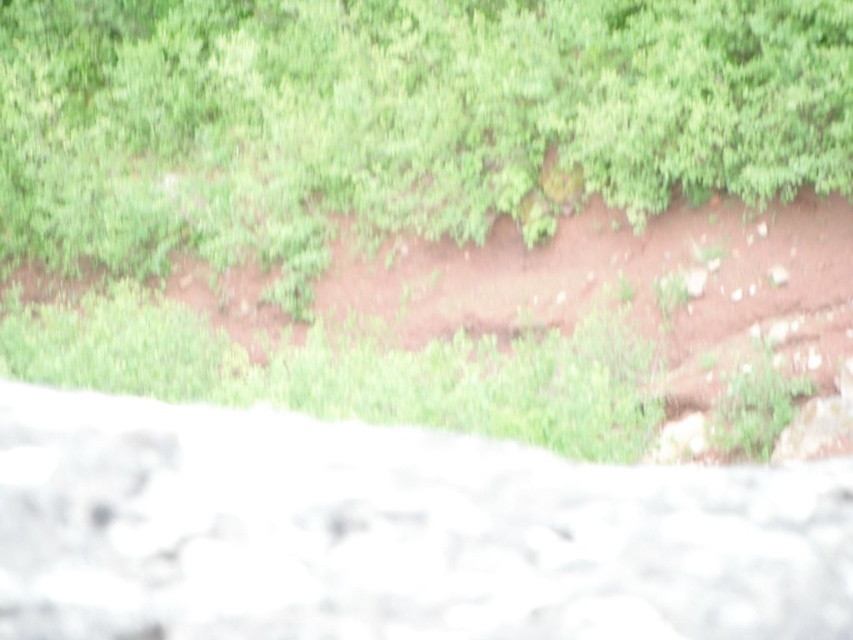
Does green leafy vegetation at upper center have a greater height compared to white marble stone at center?

Correct, green leafy vegetation at upper center is much taller as white marble stone at center.

Looking at this image, is green leafy vegetation at upper center below white marble stone at center?

Incorrect, green leafy vegetation at upper center is not positioned below white marble stone at center.

In order to click on green leafy vegetation at upper center in this screenshot , I will do `click(396, 120)`.

Which is more to the left, green leafy vegetation at upper center or brown dirt track at center?

green leafy vegetation at upper center

Who is more distant from viewer, (74, 93) or (834, 202)?

Point (74, 93)

Which is behind, point (648, 198) or point (228, 336)?

The point (228, 336) is more distant.

Locate an element on the screen. green leafy vegetation at upper center is located at coordinates (396, 120).

Is white marble stone at center to the right of brown dirt track at center from the viewer's perspective?

Correct, you'll find white marble stone at center to the right of brown dirt track at center.

What are the coordinates of `white marble stone at center` in the screenshot? It's located at (392, 532).

Where is `white marble stone at center`? The height and width of the screenshot is (640, 853). white marble stone at center is located at coordinates (392, 532).